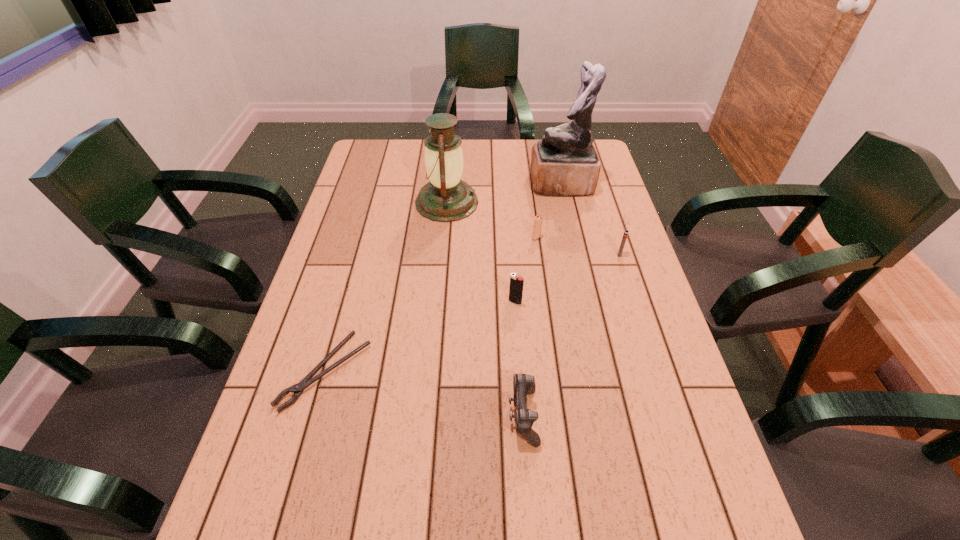
Find the location of a particular element. vacant area that lies between the tallest object and the second tallest object is located at coordinates (504, 193).

I want to click on free space that is in between the tallest object and the leftmost object, so click(444, 278).

Locate which object ranks in proximity to the sixth shortest object. Please provide its 2D coordinates. Your answer should be formatted as a tuple, i.e. [(x, y)], where the tuple contains the x and y coordinates of a point satisfying the conditions above.

[(537, 226)]

Identify which object is the fifth closest to the leftmost object. Please provide its 2D coordinates. Your answer should be formatted as a tuple, i.e. [(x, y)], where the tuple contains the x and y coordinates of a point satisfying the conditions above.

[(564, 163)]

Locate which igniter ranks second in proximity to the tallest igniter. Please provide its 2D coordinates. Your answer should be formatted as a tuple, i.e. [(x, y)], where the tuple contains the x and y coordinates of a point satisfying the conditions above.

[(626, 232)]

I want to click on igniter that can be found as the closest to the sculpture, so click(x=537, y=226).

Identify the location of vacant space that satisfies the following two spatial constraints: 1. in a relaxed pose on the second nearest igniter; 2. on the left side of the sculpture. The image size is (960, 540). (577, 254).

Where is `vacant region that satisfies the following two spatial constraints: 1. in a relaxed pose on the sculpture; 2. on the back side of the rightmost igniter`? Image resolution: width=960 pixels, height=540 pixels. vacant region that satisfies the following two spatial constraints: 1. in a relaxed pose on the sculpture; 2. on the back side of the rightmost igniter is located at coordinates (577, 254).

Find the location of `vacant area in the image that satisfies the following two spatial constraints: 1. on the back side of the second nearest igniter; 2. with the light compartment facing forward on the lantern`. vacant area in the image that satisfies the following two spatial constraints: 1. on the back side of the second nearest igniter; 2. with the light compartment facing forward on the lantern is located at coordinates (603, 202).